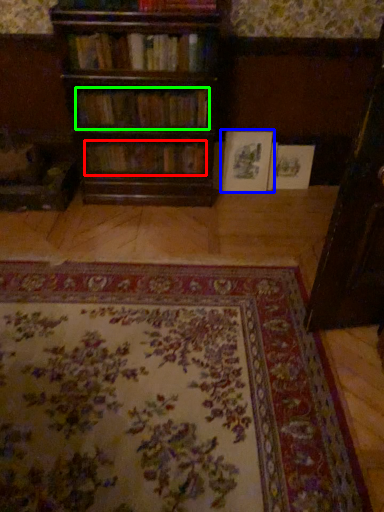
Question: Which is farther away from book (highlighted by a red box)? book (highlighted by a blue box) or book (highlighted by a green box)?

Choices:
 (A) book
 (B) book

Answer: (A)